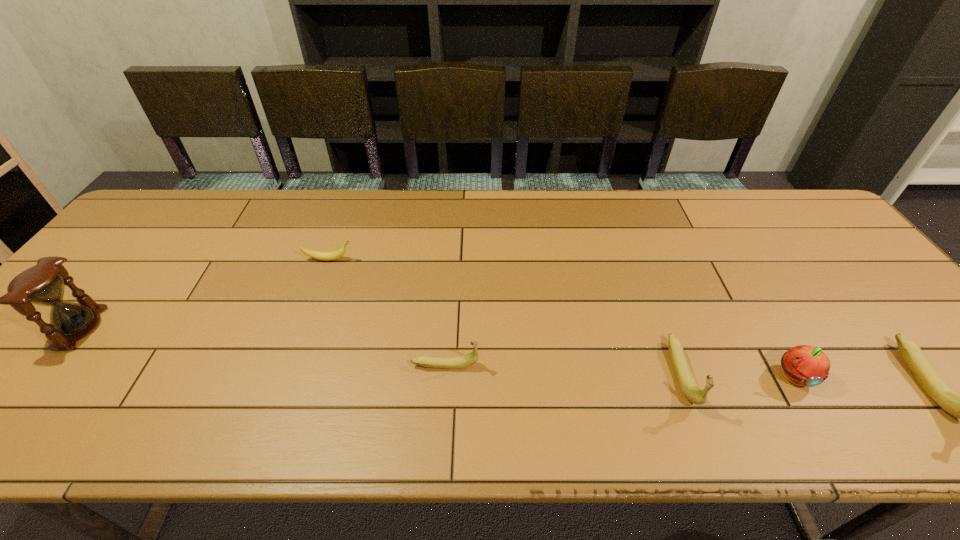
I want to click on empty space that is in between the leftmost object and the farthest object, so click(204, 294).

This screenshot has height=540, width=960. In order to click on vacant point located between the third tallest banana and the hourglass in this screenshot , I will do `click(263, 347)`.

Locate an element on the screen. The height and width of the screenshot is (540, 960). unoccupied position between the third object from right to left and the hourglass is located at coordinates (381, 351).

The width and height of the screenshot is (960, 540). Identify the location of free space between the third shortest banana and the farthest object. (505, 317).

The width and height of the screenshot is (960, 540). Identify the location of free spot between the second banana from right to left and the second shortest banana. (564, 370).

Identify which object is the fourth closest to the third shortest banana. Please provide its 2D coordinates. Your answer should be formatted as a tuple, i.e. [(x, y)], where the tuple contains the x and y coordinates of a point satisfying the conditions above.

[(333, 255)]

Choose which object is the second nearest neighbor to the shortest banana. Please provide its 2D coordinates. Your answer should be formatted as a tuple, i.e. [(x, y)], where the tuple contains the x and y coordinates of a point satisfying the conditions above.

[(43, 284)]

Identify which banana is located as the nearest to the apple. Please provide its 2D coordinates. Your answer should be formatted as a tuple, i.e. [(x, y)], where the tuple contains the x and y coordinates of a point satisfying the conditions above.

[(689, 387)]

Point out which banana is positioned as the second nearest to the second object from left to right. Please provide its 2D coordinates. Your answer should be formatted as a tuple, i.e. [(x, y)], where the tuple contains the x and y coordinates of a point satisfying the conditions above.

[(689, 387)]

Where is `free point that satisfies the following two spatial constraints: 1. at the stem of the third object from left to right; 2. on the right side of the second object from right to left`? This screenshot has height=540, width=960. free point that satisfies the following two spatial constraints: 1. at the stem of the third object from left to right; 2. on the right side of the second object from right to left is located at coordinates [x=444, y=376].